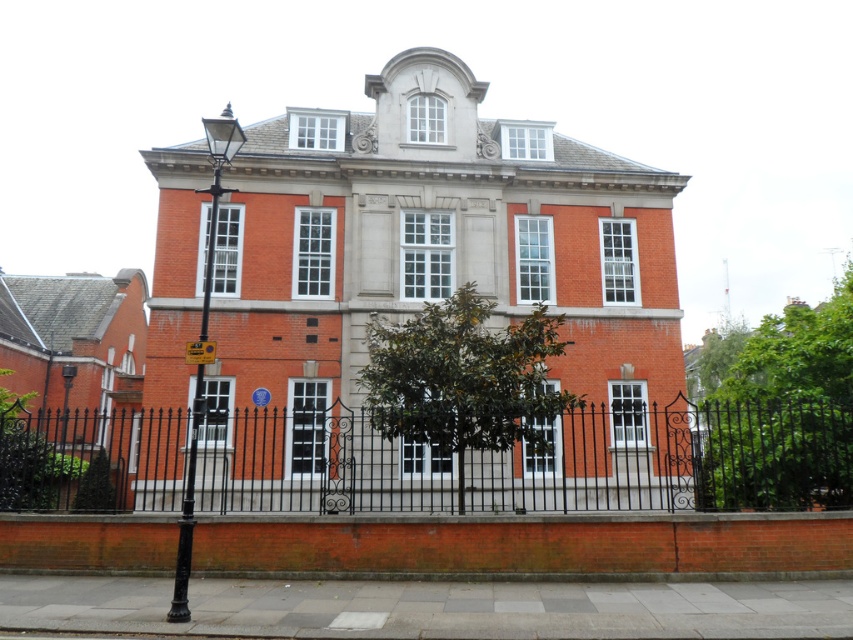
Question: Can you confirm if black wrought iron fence at center is bigger than yellow plastic sign at lower left?

Choices:
 (A) yes
 (B) no

Answer: (A)

Question: Is black wrought iron fence at center below yellow plastic sign at lower left?

Choices:
 (A) no
 (B) yes

Answer: (B)

Question: Which of the following is the farthest from the observer?

Choices:
 (A) yellow plastic sign at lower left
 (B) black wrought iron fence at center

Answer: (B)

Question: Is black wrought iron fence at center below yellow plastic sign at lower left?

Choices:
 (A) no
 (B) yes

Answer: (B)